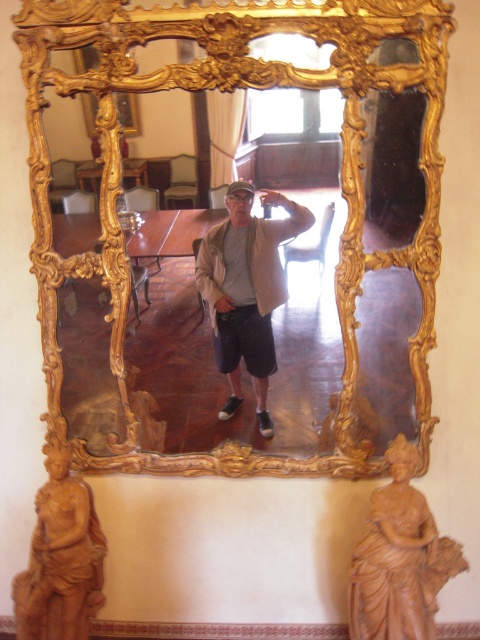
Looking at this image, does brown wood statue at lower right have a greater width compared to brown terracotta statue at lower left?

Indeed, brown wood statue at lower right has a greater width compared to brown terracotta statue at lower left.

Does brown wood statue at lower right have a lesser height compared to brown terracotta statue at lower left?

Correct, brown wood statue at lower right is not as tall as brown terracotta statue at lower left.

What do you see at coordinates (399, 557) in the screenshot? The height and width of the screenshot is (640, 480). I see `brown wood statue at lower right` at bounding box center [399, 557].

Identify the location of brown wood statue at lower right. (399, 557).

This screenshot has width=480, height=640. What do you see at coordinates (243, 248) in the screenshot?
I see `gold ornate mirror at center` at bounding box center [243, 248].

I want to click on gold ornate mirror at center, so click(x=243, y=248).

Where is `gold ornate mirror at center`? The image size is (480, 640). gold ornate mirror at center is located at coordinates (243, 248).

Is matte beige jacket at center bigger than brown terracotta statue at lower left?

No, matte beige jacket at center is not bigger than brown terracotta statue at lower left.

Who is lower down, matte beige jacket at center or brown terracotta statue at lower left?

Positioned lower is brown terracotta statue at lower left.

Who is more distant from viewer, (232, 221) or (36, 531)?

The point (232, 221) is behind.

I want to click on matte beige jacket at center, so click(247, 289).